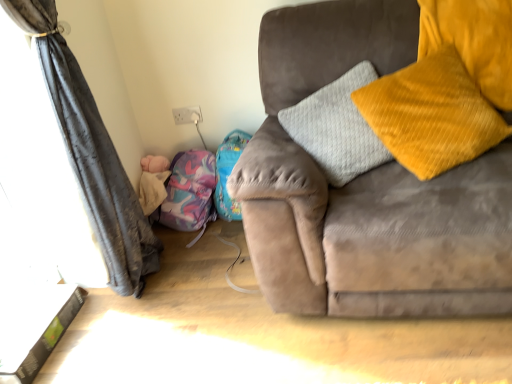
This screenshot has height=384, width=512. I want to click on vacant region to the right of white glossy table at lower left, so click(x=109, y=330).